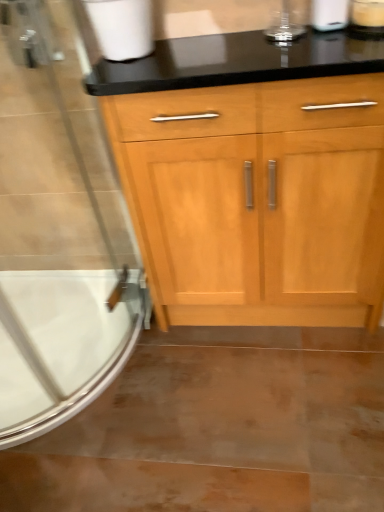
Question: From a real-world perspective, is white matte toilet paper at upper left, the first toilet paper from the left, positioned above or below satin nickel faucet at upper left?

Choices:
 (A) above
 (B) below

Answer: (B)

Question: Is white matte toilet paper at upper left, the first toilet paper from the left, taller or shorter than satin nickel faucet at upper left?

Choices:
 (A) short
 (B) tall

Answer: (A)

Question: Which object is the farthest from the white glossy bathtub at lower left?

Choices:
 (A) clear glass screen door at left
 (B) white matte toilet paper at upper left, the second toilet paper positioned from the right
 (C) satin nickel faucet at upper left
 (D) white matte toilet paper at upper right, placed as the 2th toilet paper when sorted from left to right

Answer: (D)

Question: Estimate the real-world distances between objects in this image. Which object is farther from the satin nickel faucet at upper left?

Choices:
 (A) white matte toilet paper at upper right, placed as the 2th toilet paper when sorted from left to right
 (B) white glossy bathtub at lower left
 (C) clear glass screen door at left
 (D) white matte toilet paper at upper left, the second toilet paper positioned from the right

Answer: (B)